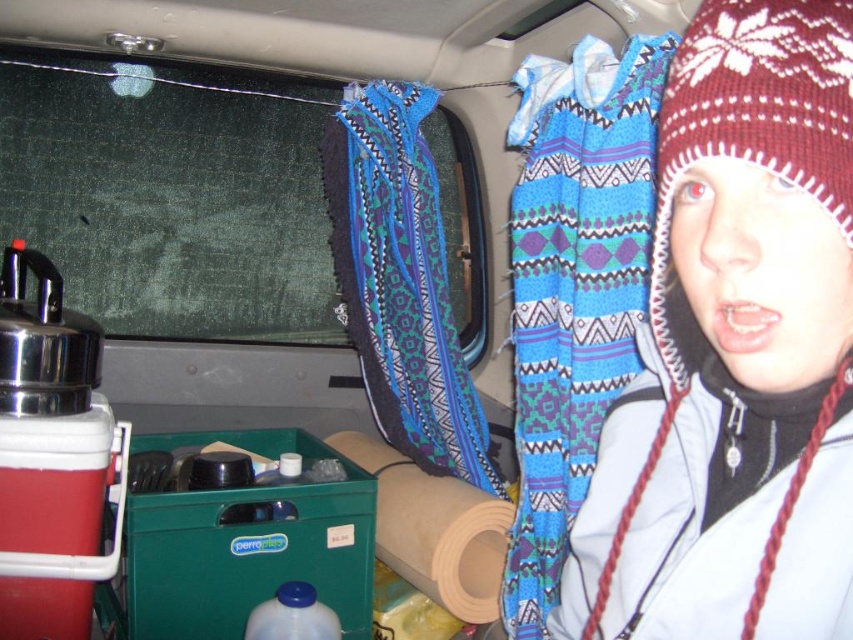
Question: Is knitted woolen hat at upper right wider than blue woven blanket at upper center?

Choices:
 (A) yes
 (B) no

Answer: (B)

Question: Does knitted woolen hat at upper right lie behind blue woven blanket at center?

Choices:
 (A) no
 (B) yes

Answer: (A)

Question: Does knitted woolen hat at upper right come behind blue woven blanket at upper center?

Choices:
 (A) no
 (B) yes

Answer: (A)

Question: Which of the following is the farthest from the observer?

Choices:
 (A) (726, 3)
 (B) (413, 284)
 (C) (541, 328)

Answer: (B)

Question: Which object is the farthest from the blue woven blanket at center?

Choices:
 (A) knitted woolen hat at upper right
 (B) blue woven blanket at upper center

Answer: (A)

Question: Based on their relative distances, which object is nearer to the knitted woolen hat at upper right?

Choices:
 (A) blue woven blanket at upper center
 (B) blue woven blanket at center

Answer: (A)